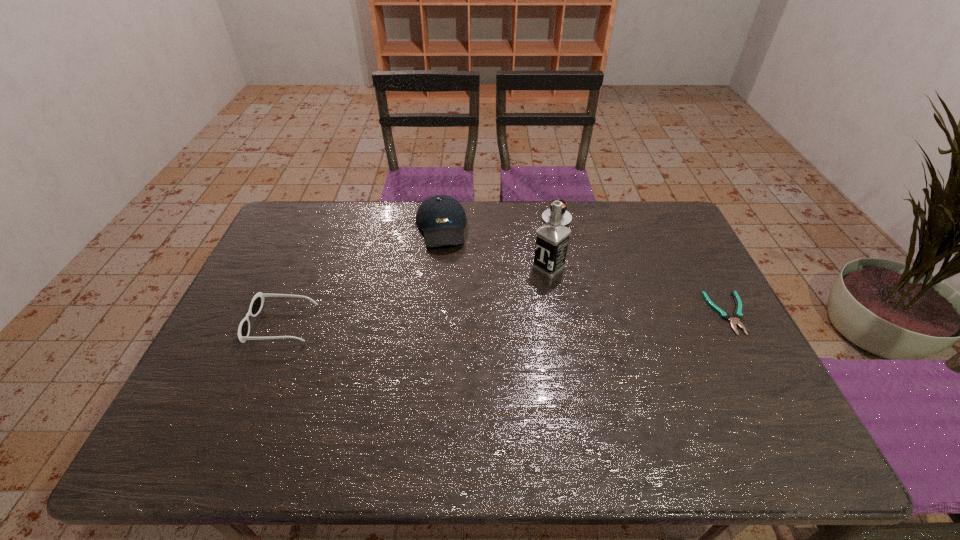
Locate an element on the screen. The image size is (960, 540). baseball cap located at the far edge is located at coordinates (441, 218).

Where is `object at the left edge`? Image resolution: width=960 pixels, height=540 pixels. object at the left edge is located at coordinates (257, 302).

Find the location of a particular element. Image resolution: width=960 pixels, height=540 pixels. object present at the right edge is located at coordinates (738, 315).

Where is `free space at the far edge of the desktop`? free space at the far edge of the desktop is located at coordinates (497, 210).

Identify the location of vacant region at the near edge of the desktop. This screenshot has width=960, height=540. 500,391.

Locate an element on the screen. vacant region at the left edge of the desktop is located at coordinates (276, 269).

You are a GUI agent. You are given a task and a screenshot of the screen. Output one action in this format:
    pyautogui.click(x=<x>, y=<y>)
    Task: Click on the free space at the right edge of the desktop
    This screenshot has width=960, height=540.
    Given the screenshot: What is the action you would take?
    pyautogui.click(x=715, y=296)

In the image, there is a desktop. Identify the location of vacant space at the far left corner. The width and height of the screenshot is (960, 540). (298, 217).

Locate an element on the screen. vacant area at the near left corner of the desktop is located at coordinates (238, 408).

Locate an element on the screen. vacant space at the far right corner of the desktop is located at coordinates (639, 227).